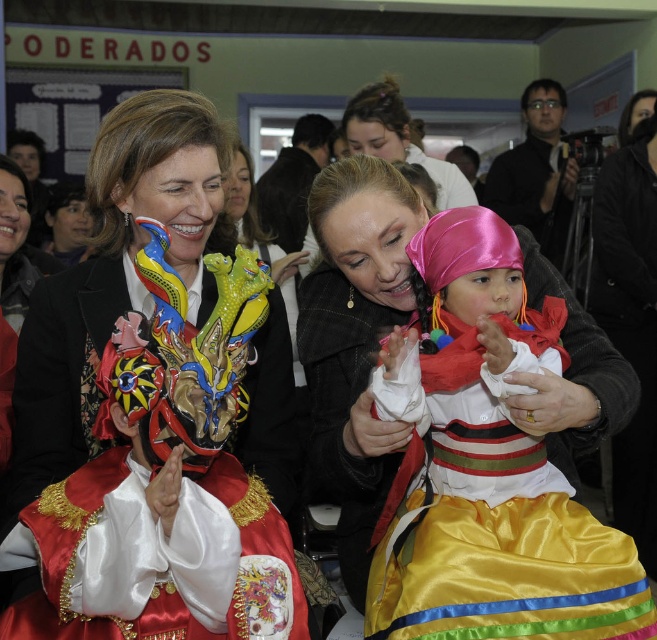
Question: Is satin/yellow dress at center to the right of satin pink headscarf at upper center from the viewer's perspective?

Choices:
 (A) no
 (B) yes

Answer: (B)

Question: Does black glossy camera at upper right appear under satin pink headscarf at upper center?

Choices:
 (A) no
 (B) yes

Answer: (A)

Question: Among these objects, which one is farthest from the camera?

Choices:
 (A) satin/yellow dress at center
 (B) satin pink headscarf at upper center
 (C) black glossy camera at upper right
 (D) satin/embroidered dress at center

Answer: (C)

Question: Based on their relative distances, which object is farther from the satin/embroidered dress at center?

Choices:
 (A) satin pink headscarf at upper center
 (B) black glossy camera at upper right
 (C) satin/yellow dress at center

Answer: (B)

Question: Based on their relative distances, which object is nearer to the satin/embroidered dress at center?

Choices:
 (A) satin/yellow dress at center
 (B) black glossy camera at upper right
 (C) satin pink headscarf at upper center

Answer: (A)

Question: Is satin/yellow dress at center above satin pink headscarf at upper center?

Choices:
 (A) yes
 (B) no

Answer: (B)